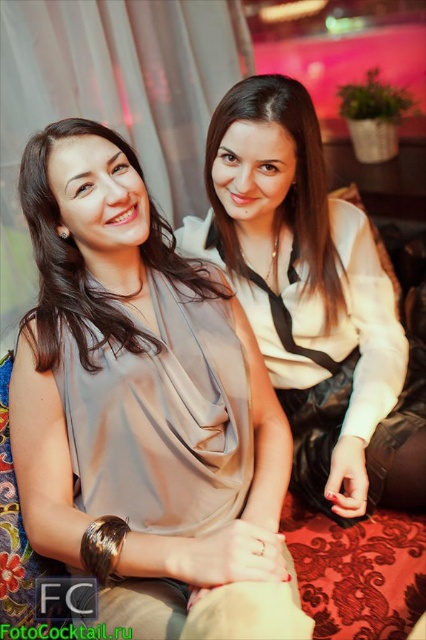
Does satin beige blouse at center have a lesser height compared to satin beige blouse at left?

Incorrect, satin beige blouse at center's height does not fall short of satin beige blouse at left's.

Who is positioned more to the left, satin beige blouse at center or satin beige blouse at left?

satin beige blouse at left is more to the left.

Is point (391, 449) positioned behind point (40, 170)?

Yes, it is behind point (40, 170).

The image size is (426, 640). I want to click on satin beige blouse at center, so click(311, 301).

How distant is matte gray blouse at center from satin beige blouse at center?

A distance of 32.84 centimeters exists between matte gray blouse at center and satin beige blouse at center.

Who is positioned more to the left, matte gray blouse at center or satin beige blouse at center?

matte gray blouse at center is more to the left.

What do you see at coordinates (138, 396) in the screenshot?
I see `matte gray blouse at center` at bounding box center [138, 396].

Find the location of `matte gray blouse at center`. matte gray blouse at center is located at coordinates (138, 396).

Does point (49, 422) come in front of point (224, 250)?

That is True.

Does matte gray blouse at center lie behind matte white blouse at center?

That is False.

Is point (250, 502) in front of point (241, 259)?

Yes, point (250, 502) is closer to viewer.

This screenshot has height=640, width=426. What are the coordinates of `matte gray blouse at center` in the screenshot? It's located at (138, 396).